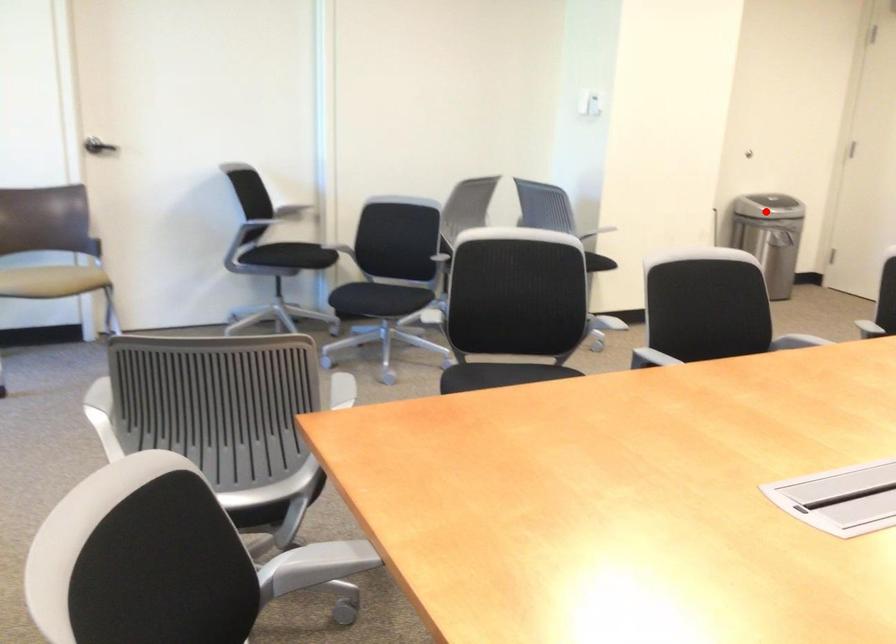
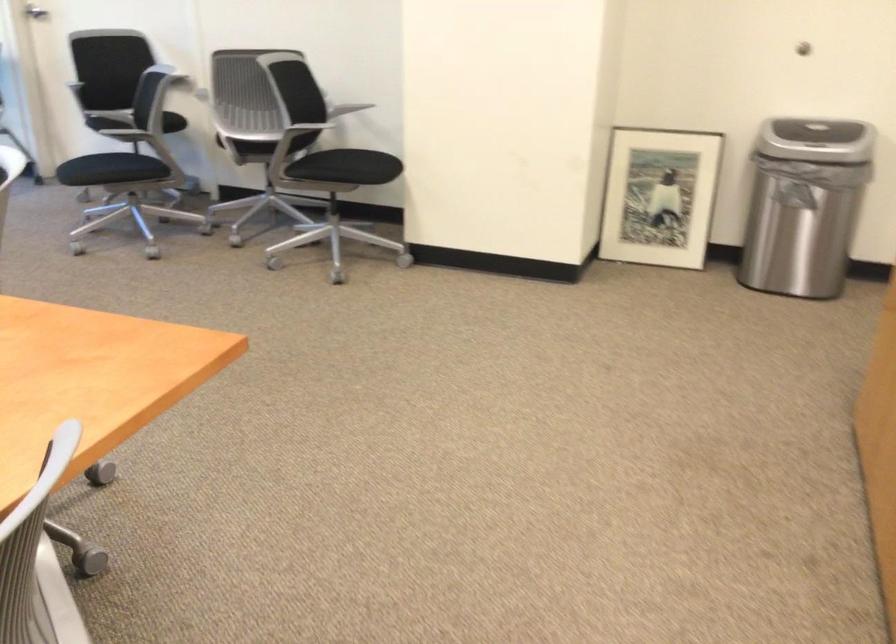
Question: I am providing you with two images of the same scene from different viewpoints. A red point is marked on the first image. Can you still see the location of the red point in image 2?

Choices:
 (A) Yes
 (B) No

Answer: (B)